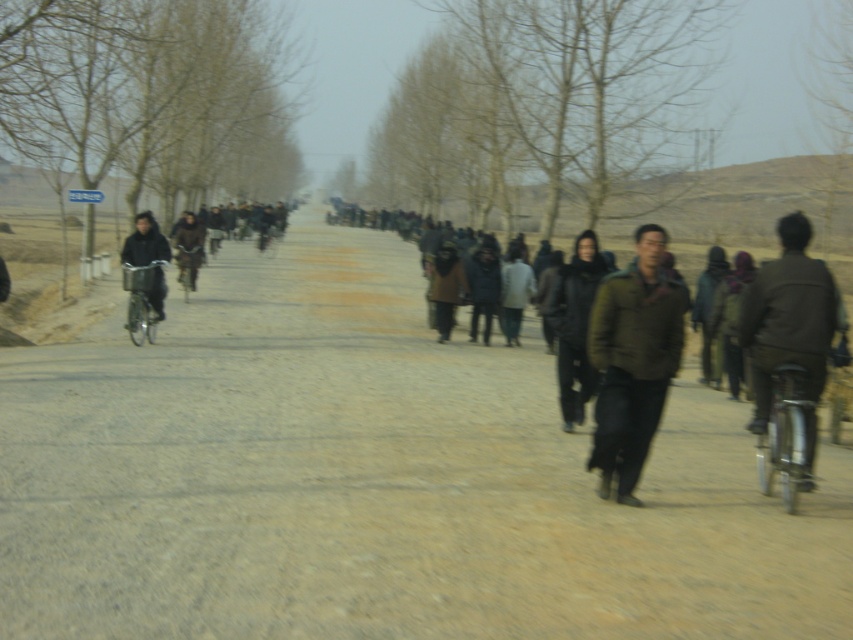
At what (x,y) coordinates should I click in order to perform the action: click on metallic silver bicycle at left. Please return your answer as a coordinate pair (x, y). The image size is (853, 640). Looking at the image, I should click on (140, 300).

From the picture: Which of these two, metallic silver bicycle at left or silver metallic bicycle at left, stands shorter?

silver metallic bicycle at left

Describe the element at coordinates (140, 300) in the screenshot. I see `metallic silver bicycle at left` at that location.

Where is `metallic silver bicycle at left`? The width and height of the screenshot is (853, 640). metallic silver bicycle at left is located at coordinates (140, 300).

Between dark gray wool coat at center and metallic silver bicycle at left, which one appears on the left side from the viewer's perspective?

Positioned to the left is metallic silver bicycle at left.

Is dark gray wool coat at center positioned at the back of metallic silver bicycle at left?

Yes, dark gray wool coat at center is further from the viewer.

Measure the distance between point (502,284) and camera.

The distance of point (502,284) from camera is 58.95 feet.

At what (x,y) coordinates should I click in order to perform the action: click on dark gray wool coat at center. Please return your answer as a coordinate pair (x, y). Looking at the image, I should click on (514, 291).

Can you confirm if dirt road at center is positioned to the right of dark gray wool coat at center?

Incorrect, dirt road at center is not on the right side of dark gray wool coat at center.

Which is more to the right, dirt road at center or dark gray wool coat at center?

Positioned to the right is dark gray wool coat at center.

Who is more forward, (x=367, y=264) or (x=514, y=257)?

Point (x=514, y=257) is in front.

Identify the location of dirt road at center. (375, 480).